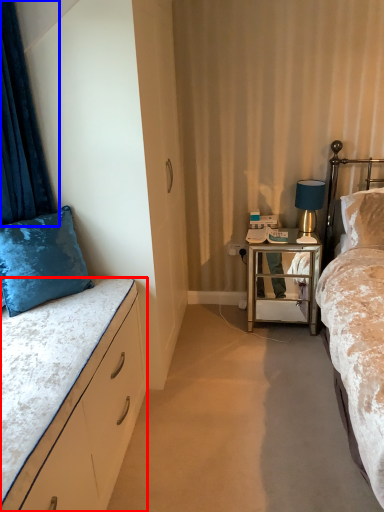
Question: Which of the following is the closest to the observer, bed (highlighted by a red box) or curtain (highlighted by a blue box)?

Choices:
 (A) bed
 (B) curtain

Answer: (A)